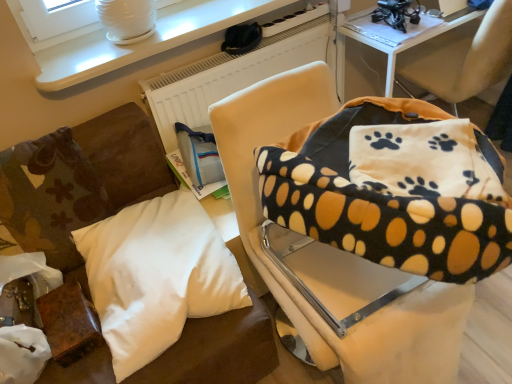
Find the location of a particular element. The width and height of the screenshot is (512, 384). free space above white fleece pillow at upper right, which ranks as the 1th pillow in right-to-left order (from a real-world perspective) is located at coordinates (407, 142).